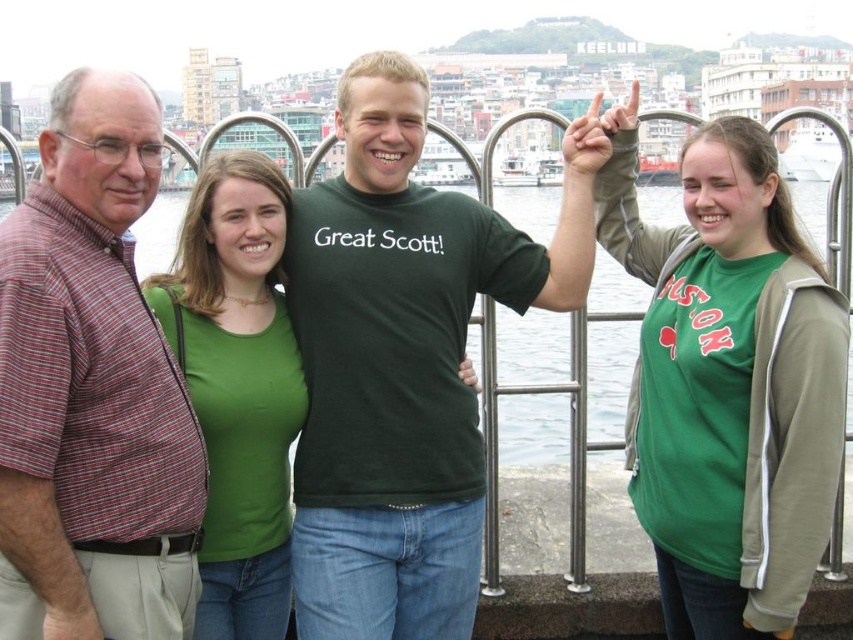
Question: Is green matte t-shirt at center wider than striped cotton shirt at left?

Choices:
 (A) no
 (B) yes

Answer: (B)

Question: Which point is farther from the camera taking this photo?

Choices:
 (A) (114, 140)
 (B) (398, 458)

Answer: (B)

Question: Does striped cotton shirt at left have a larger size compared to green matte shirt at center?

Choices:
 (A) yes
 (B) no

Answer: (B)

Question: Is green matte t-shirt at center bigger than green matte shirt at center?

Choices:
 (A) no
 (B) yes

Answer: (B)

Question: Estimate the real-world distances between objects in this image. Which object is farther from the green matte shirt at upper right?

Choices:
 (A) green matte shirt at center
 (B) green matte t-shirt at center

Answer: (A)

Question: Estimate the real-world distances between objects in this image. Which object is closer to the green matte t-shirt at center?

Choices:
 (A) green matte shirt at upper right
 (B) green matte shirt at center
 (C) striped cotton shirt at left

Answer: (B)